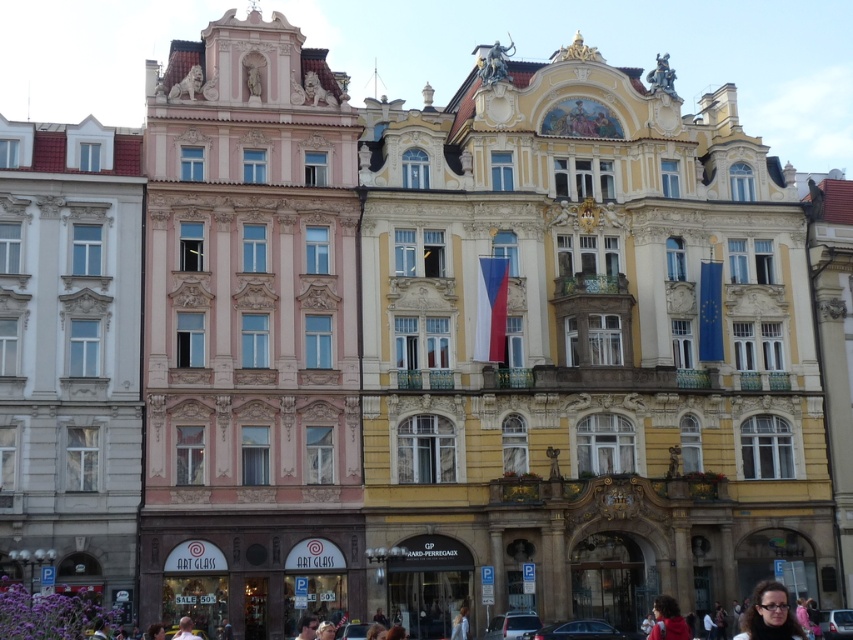
Can you confirm if blue fabric flag at center is shorter than dark brown hair at lower center?

Indeed, blue fabric flag at center has a lesser height compared to dark brown hair at lower center.

Who is shorter, blue fabric flag at center or dark brown hair at lower center?

blue fabric flag at center is shorter.

Does point (704, 324) come in front of point (309, 620)?

That is False.

This screenshot has width=853, height=640. What are the coordinates of `blue fabric flag at center` in the screenshot? It's located at (711, 312).

Between point (486, 305) and point (718, 262), which one is positioned behind?

The point (718, 262) is more distant.

Between blue and white striped fabric at center and blue fabric flag at center, which one is positioned lower?

blue and white striped fabric at center

Does point (496, 342) lie behind point (718, 312)?

No, it is in front of (718, 312).

The image size is (853, 640). Find the location of `blue and white striped fabric at center`. blue and white striped fabric at center is located at coordinates (491, 308).

The height and width of the screenshot is (640, 853). Identify the location of white stone building at left. (70, 356).

Which is more to the right, white stone building at left or blue fabric flag at center?

blue fabric flag at center

I want to click on white stone building at left, so click(x=70, y=356).

Identify the location of white stone building at left. The image size is (853, 640). (70, 356).